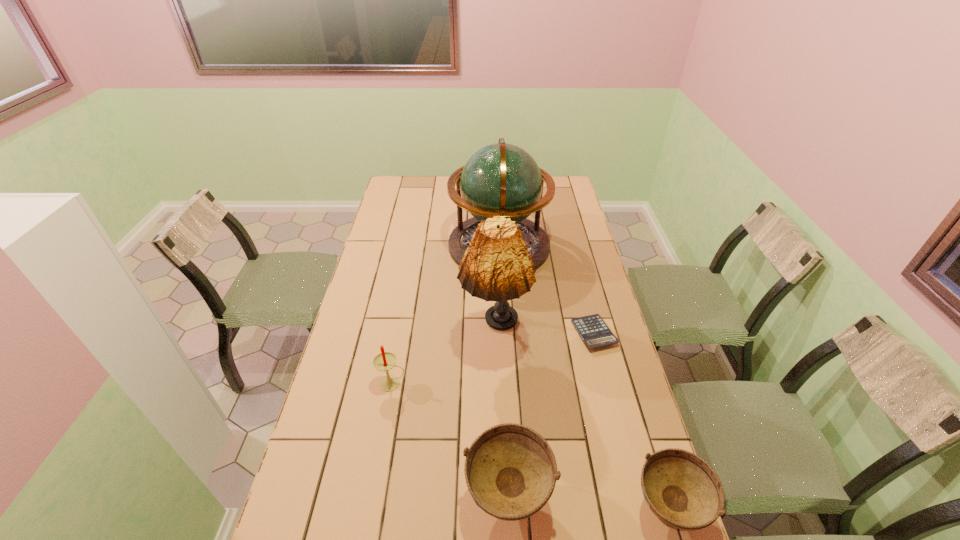
Please point a spot to add another soup bowl on the left. Please provide its 2D coordinates. Your answer should be formatted as a tuple, i.e. [(x, y)], where the tuple contains the x and y coordinates of a point satisfying the conditions above.

[(355, 488)]